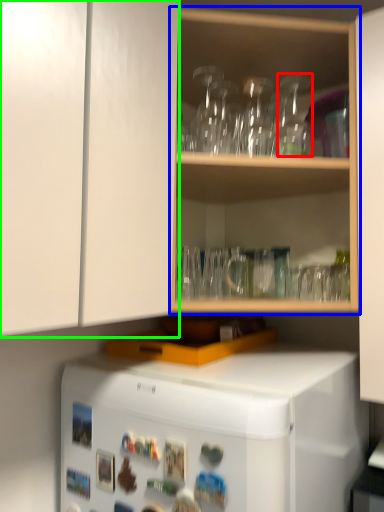
Question: Considering the real-world distances, which object is closest to glass vase (highlighted by a red box)? shelf (highlighted by a blue box) or cabinetry (highlighted by a green box).

Choices:
 (A) shelf
 (B) cabinetry

Answer: (A)